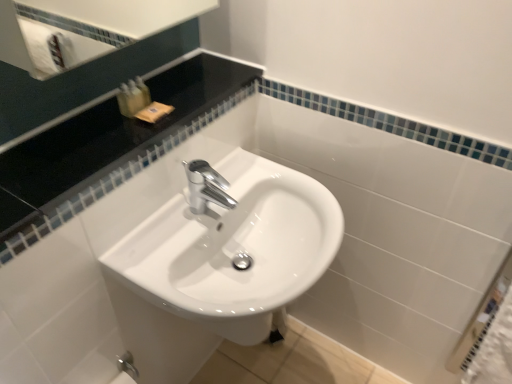
Image resolution: width=512 pixels, height=384 pixels. I want to click on free space to the left of polished chrome tap at center, so click(x=158, y=225).